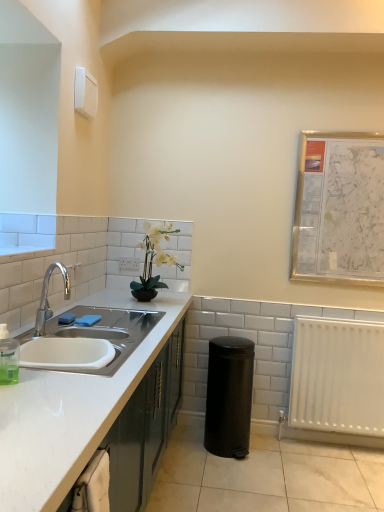
The image size is (384, 512). I want to click on vacant region under white matte vase at center (from a real-world perspective), so click(x=162, y=302).